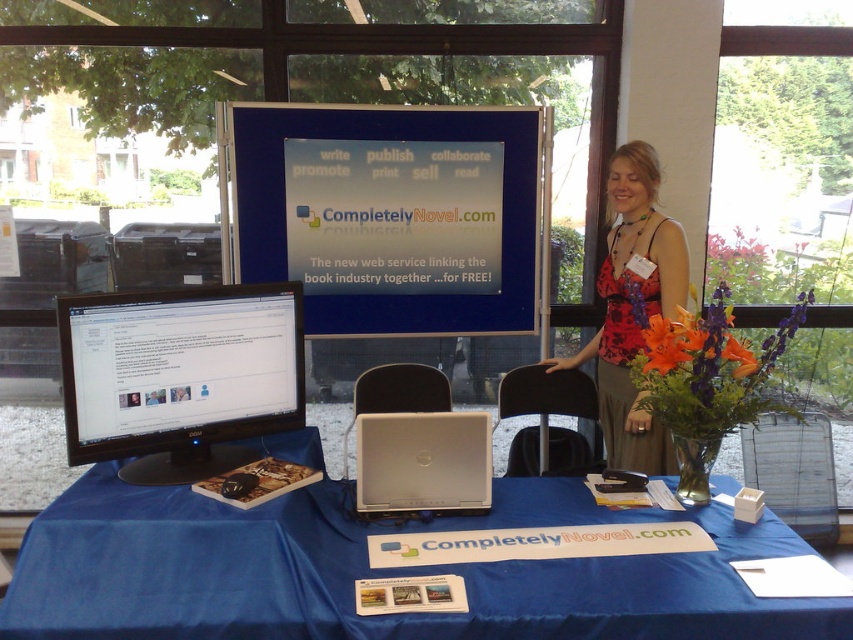
I want to click on blue fabric table at center, so click(x=376, y=572).

Which is behind, point (334, 529) or point (608, 168)?

Point (608, 168)

Locate an element on the screen. The height and width of the screenshot is (640, 853). blue fabric table at center is located at coordinates pos(376,572).

Is point (358, 305) closer to viewer compared to point (213, 292)?

No, (358, 305) is further to viewer.

Is blue plastic signboard at center to the right of black glossy monitor at left from the viewer's perspective?

Correct, you'll find blue plastic signboard at center to the right of black glossy monitor at left.

Does point (305, 221) come closer to viewer compared to point (143, 314)?

No, (305, 221) is behind (143, 314).

This screenshot has height=640, width=853. Find the location of `blue plastic signboard at center`. blue plastic signboard at center is located at coordinates (390, 214).

Does blue fabric table at center appear on the right side of blue plastic signboard at center?

Yes, blue fabric table at center is to the right of blue plastic signboard at center.

From the picture: Can you confirm if blue fabric table at center is positioned below blue plastic signboard at center?

Yes, blue fabric table at center is below blue plastic signboard at center.

Who is more distant from viewer, (215, 625) or (374, 259)?

The point (374, 259) is behind.

The width and height of the screenshot is (853, 640). I want to click on blue fabric table at center, so tap(376, 572).